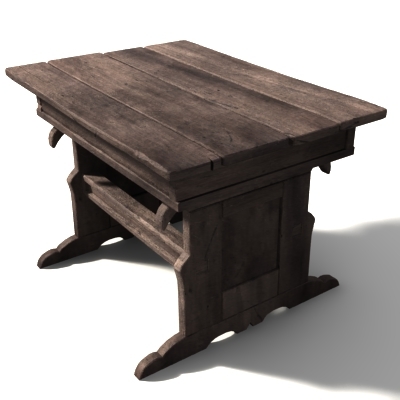
I want to click on arches in table base, so click(x=109, y=240), click(x=219, y=337), click(x=272, y=313).